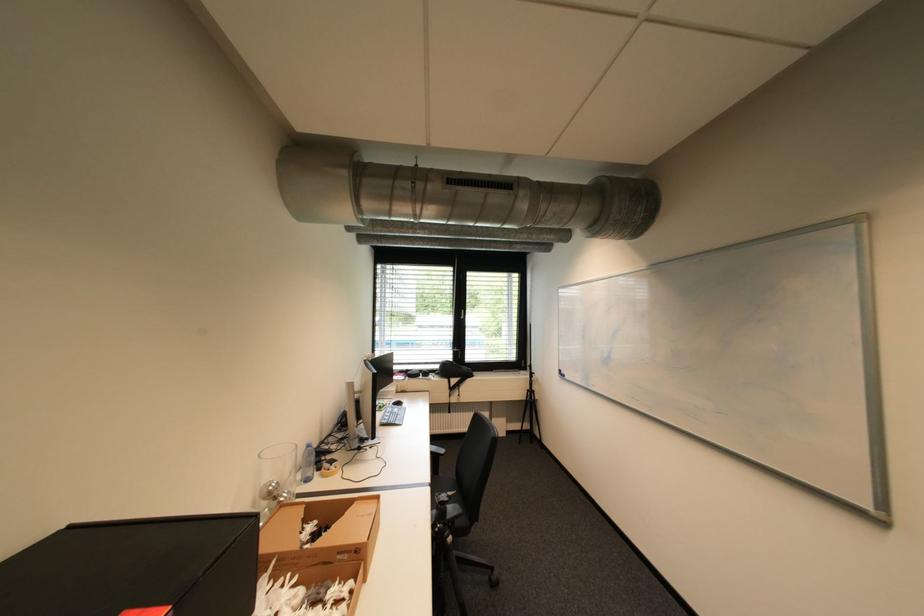
Where would you lift the glass jar? Please return your answer as a coordinate pair (x, y).

(275, 477)